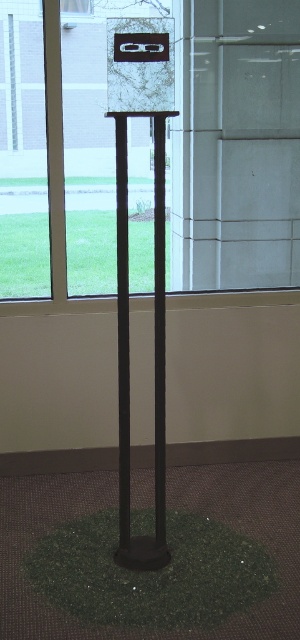
You are standing in the room with the sculpture and want to walk to the transparent glass window at upper center. Which direction should you face to move towards it from the green grass at lower center?

To move towards the transparent glass window at upper center from the green grass at lower center, you should face left since the green grass at lower center is to the right of the window.

You are a gardener who needs to mow the green grass at lower center. However, you can only access the area through the transparent glass window at upper center. Considering their sizes, can you fit through the window to reach the grass?

The green grass at lower center is taller than the transparent glass window at upper center, so the window is shorter than the grass. Since the window is shorter, you cannot fit through it to reach the grass.